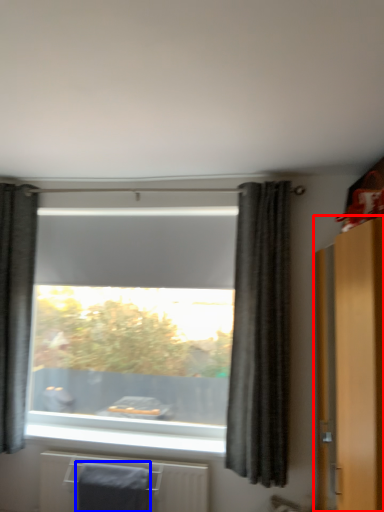
Question: Which point is further to the camera, dresser (highlighted by a red box) or bath towel (highlighted by a blue box)?

Choices:
 (A) dresser
 (B) bath towel

Answer: (B)